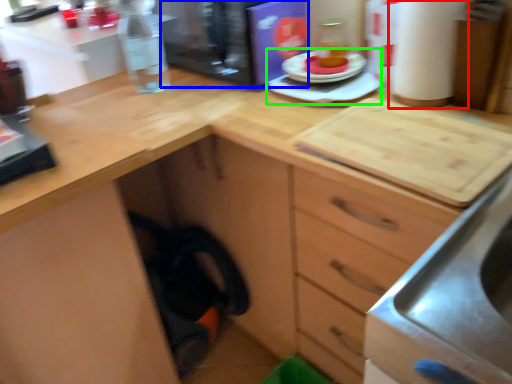
Question: Considering the real-world distances, which object is farthest from paper towel (highlighted by a red box)? appliance (highlighted by a blue box) or appliance (highlighted by a green box)?

Choices:
 (A) appliance
 (B) appliance

Answer: (A)